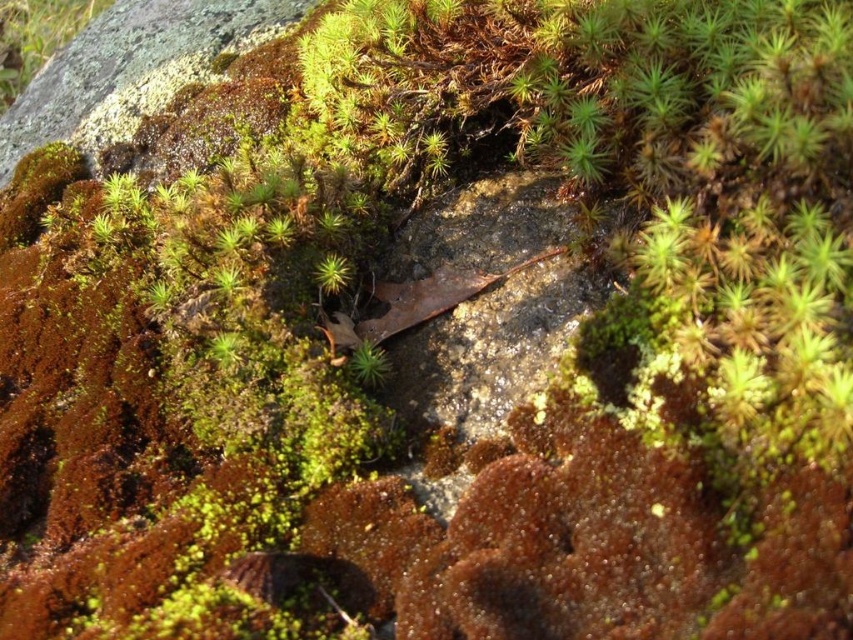
Does green mossy plant at upper left have a smaller size compared to green fuzzy moss at center?

Incorrect, green mossy plant at upper left is not smaller in size than green fuzzy moss at center.

Is point (9, 19) positioned in front of point (374, 378)?

That is False.

I want to click on green mossy plant at upper left, so click(x=36, y=36).